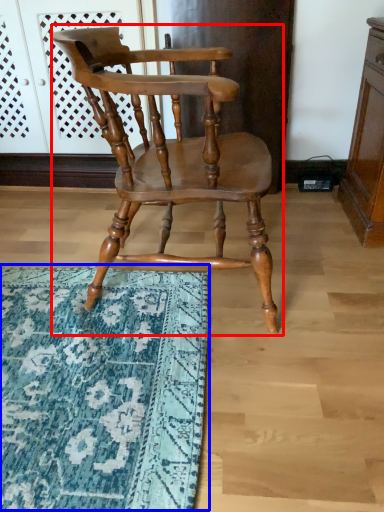
Question: Which point is further to the camera, chair (highlighted by a red box) or mat (highlighted by a blue box)?

Choices:
 (A) chair
 (B) mat

Answer: (B)